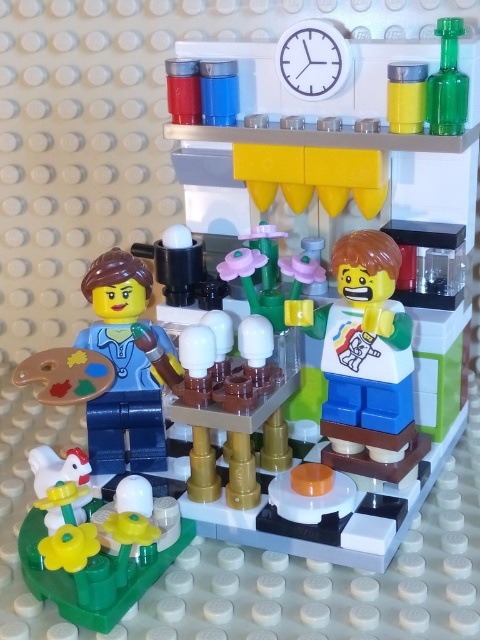
Question: Which point is farther from the camera taking this photo?

Choices:
 (A) (456, 65)
 (B) (43, 573)

Answer: (A)

Question: Is smooth white plate at center thinner than green translucent plastic bottle at upper right?

Choices:
 (A) yes
 (B) no

Answer: (B)

Question: Which of the following is the closest to the observer?

Choices:
 (A) (382, 244)
 (B) (445, 35)

Answer: (B)

Question: Is yellow matte flower at lower left bigger than matte blue figure at left?

Choices:
 (A) yes
 (B) no

Answer: (A)

Question: Estimate the real-world distances between objects in this image. Which object is farther from the green translucent plastic bottle at upper right?

Choices:
 (A) yellow matte flower at lower left
 (B) smooth white plate at center

Answer: (A)

Question: Does smooth white plate at center have a greater width compared to yellow matte flower at lower left?

Choices:
 (A) yes
 (B) no

Answer: (B)